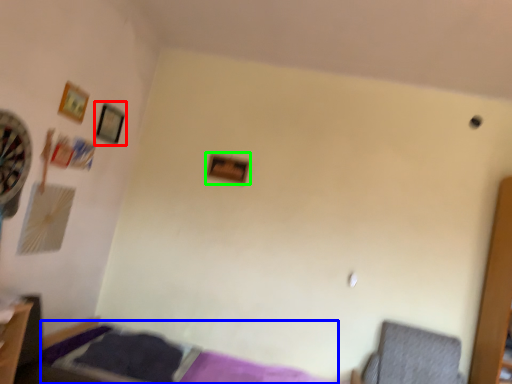
Question: Based on their relative distances, which object is farther from picture frame (highlighted by a red box)? Choose from bed (highlighted by a blue box) and picture frame (highlighted by a green box).

Choices:
 (A) bed
 (B) picture frame

Answer: (A)